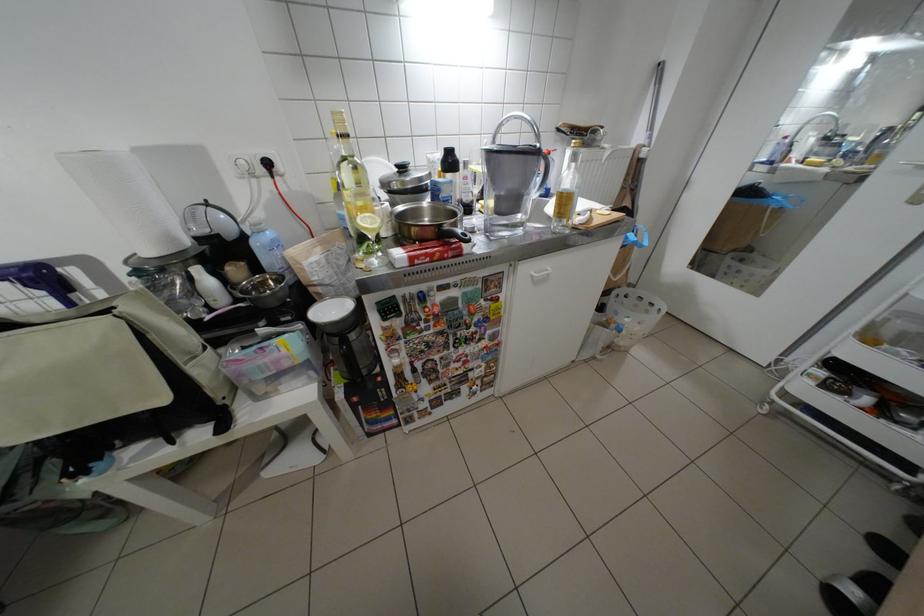
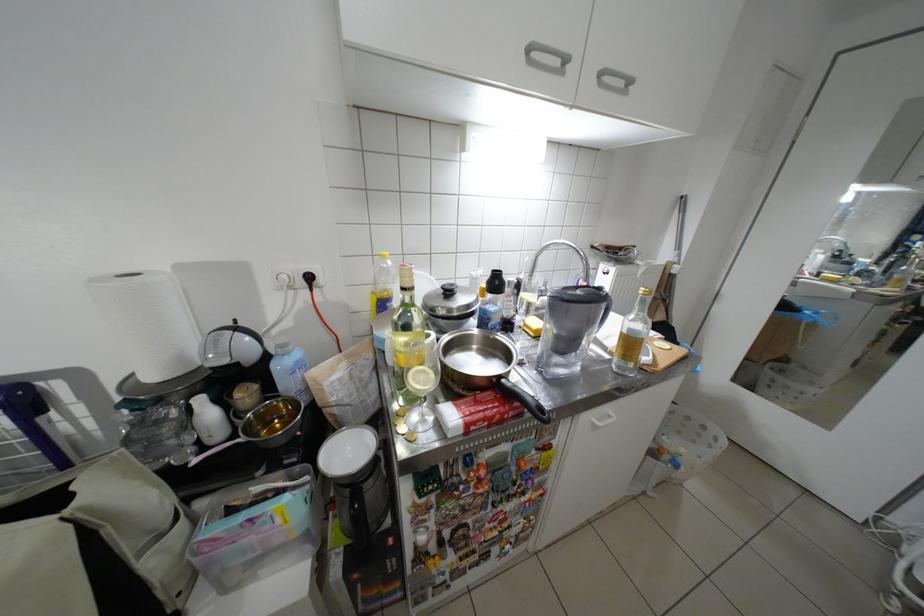
Locate, in the second image, the point that corresponds to the point at 472,257 in the first image.

(532, 415)